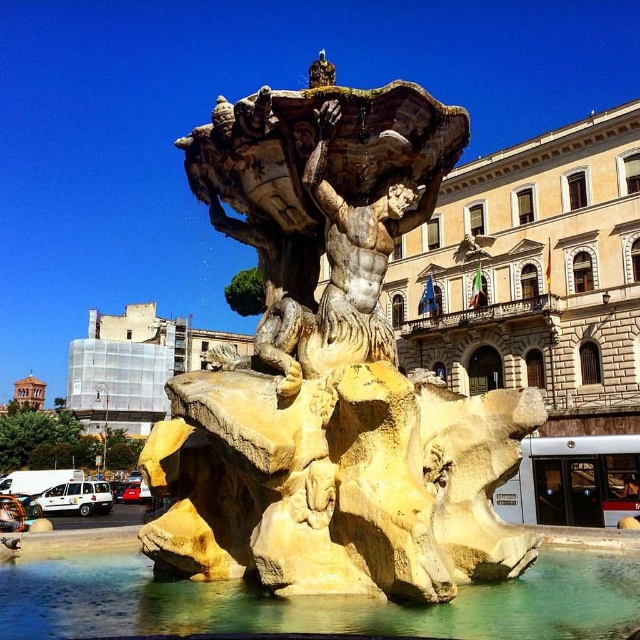
Which is behind, point (330, 582) or point (188, 580)?

The point (188, 580) is behind.

Image resolution: width=640 pixels, height=640 pixels. Identify the location of yellow stone fountain at center. (330, 369).

Who is more forward, (244, 573) or (557, 637)?

Point (557, 637)

I want to click on yellow stone fountain at center, so click(330, 369).